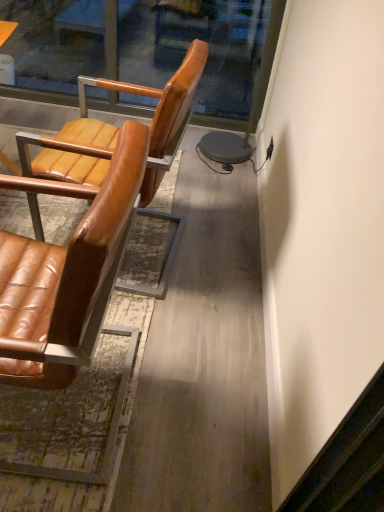
Locate an element on the screen. The height and width of the screenshot is (512, 384). vacant space to the right of brown leather chair at left, the 1th chair positioned from the front is located at coordinates (192, 398).